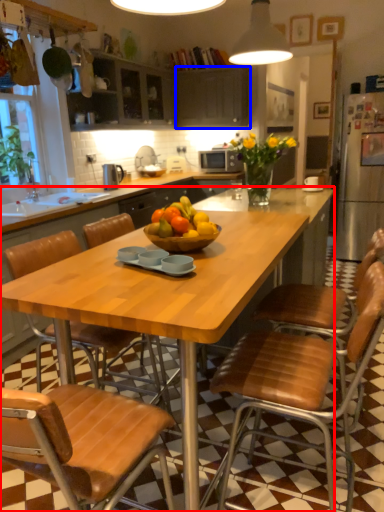
Question: Which object is closer to the camera taking this photo, desk (highlighted by a red box) or cabinetry (highlighted by a blue box)?

Choices:
 (A) desk
 (B) cabinetry

Answer: (A)